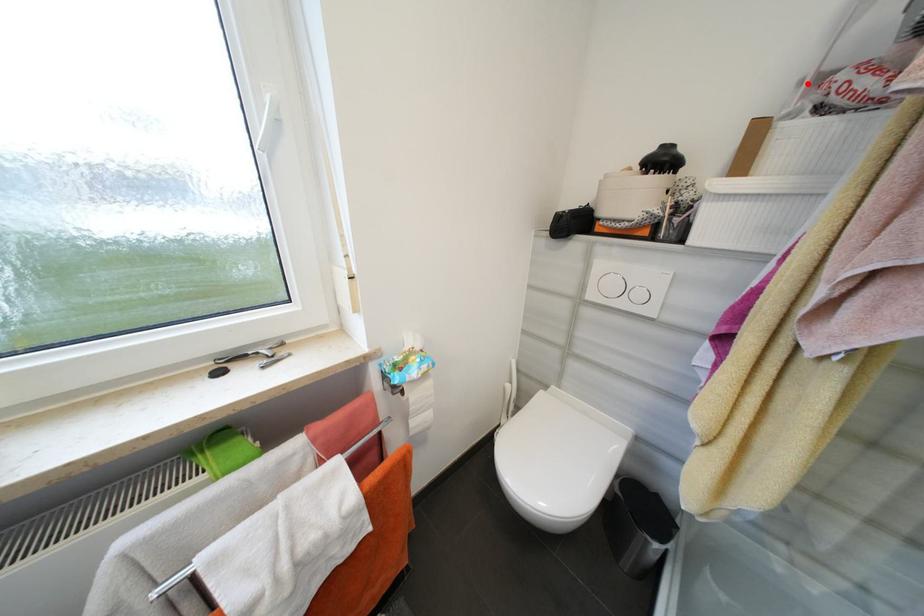
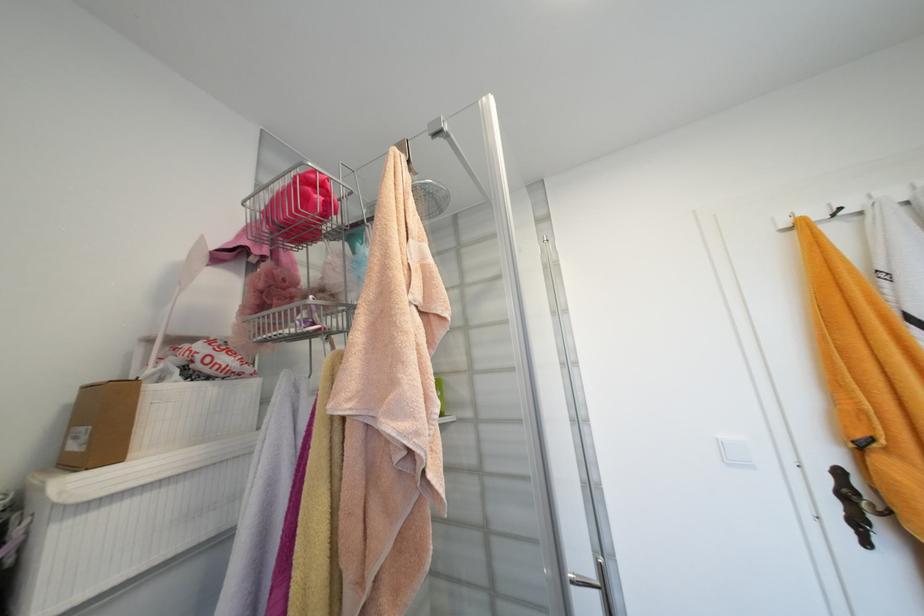
The point at the highlighted location is marked in the first image. Where is the corresponding point in the second image?

(154, 342)